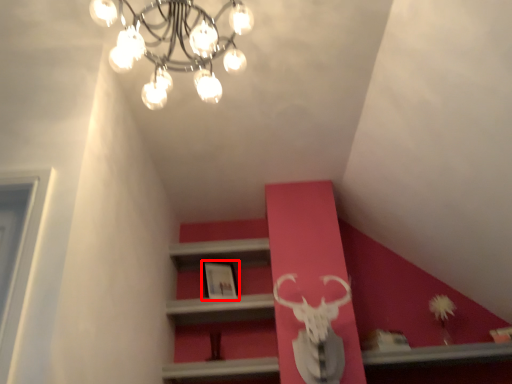
Question: From the image's perspective, considering the relative positions of picture frame (annotated by the red box) and lamp in the image provided, where is picture frame (annotated by the red box) located with respect to the staircase?

Choices:
 (A) above
 (B) below

Answer: (B)